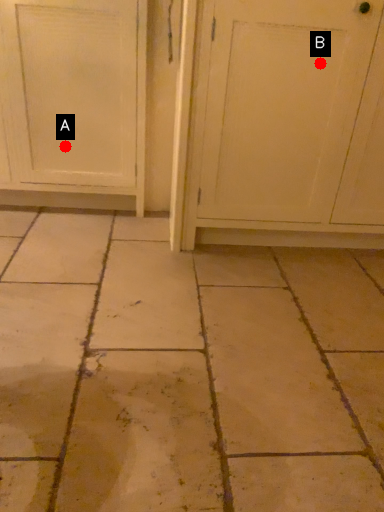
Question: Two points are circled on the image, labeled by A and B beside each circle. Which point is farther to the camera?

Choices:
 (A) A is further
 (B) B is further

Answer: (A)